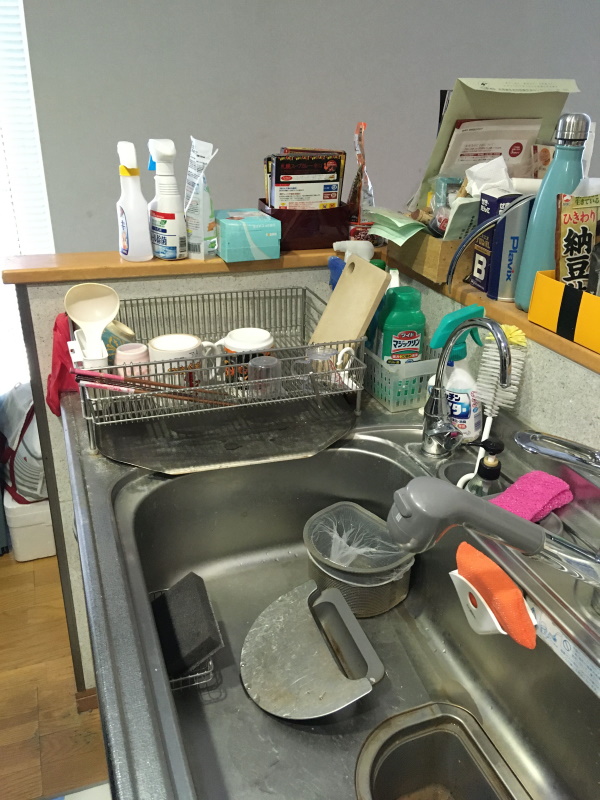
The height and width of the screenshot is (800, 600). I want to click on drying mugs, so click(x=172, y=352), click(x=139, y=361), click(x=253, y=350), click(x=109, y=340).